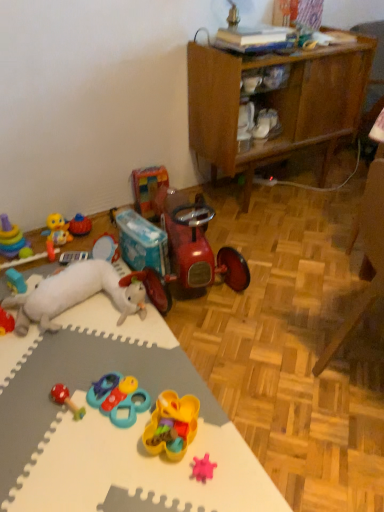
Where is `free space to the left of teal plastic toy at center, the eighth toy viewed from the left`? free space to the left of teal plastic toy at center, the eighth toy viewed from the left is located at coordinates (63, 401).